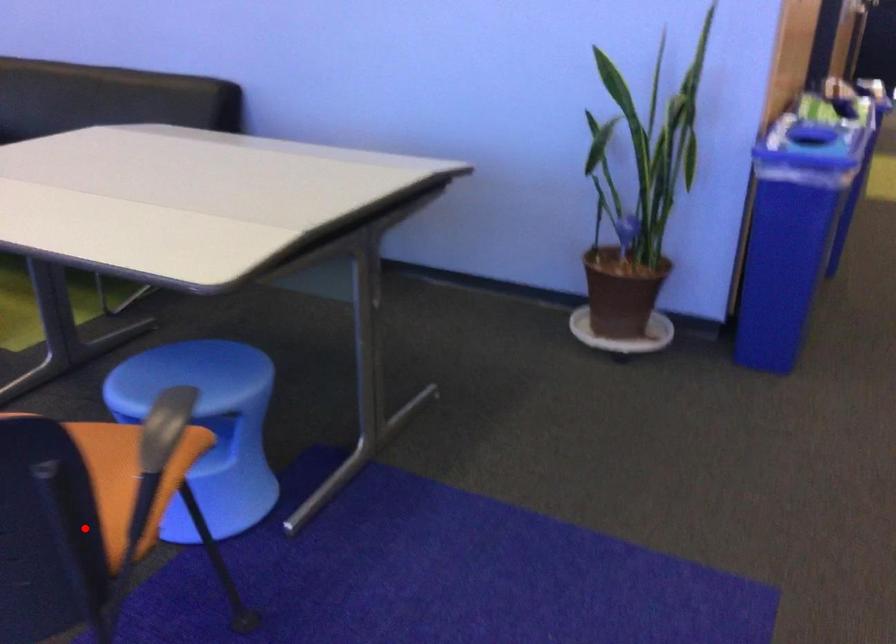
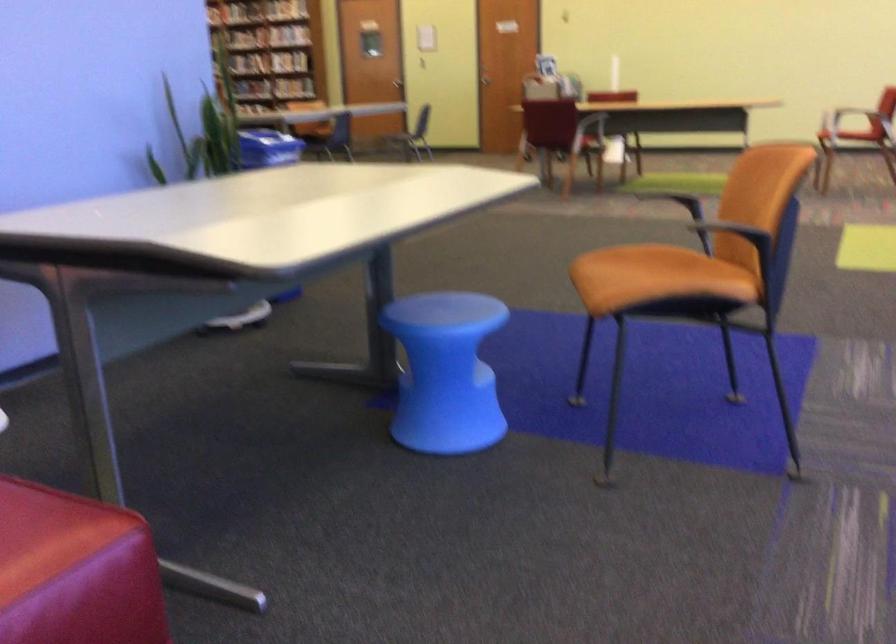
Find the pixel in the second image that matches the highlighted location in the first image.

(682, 270)